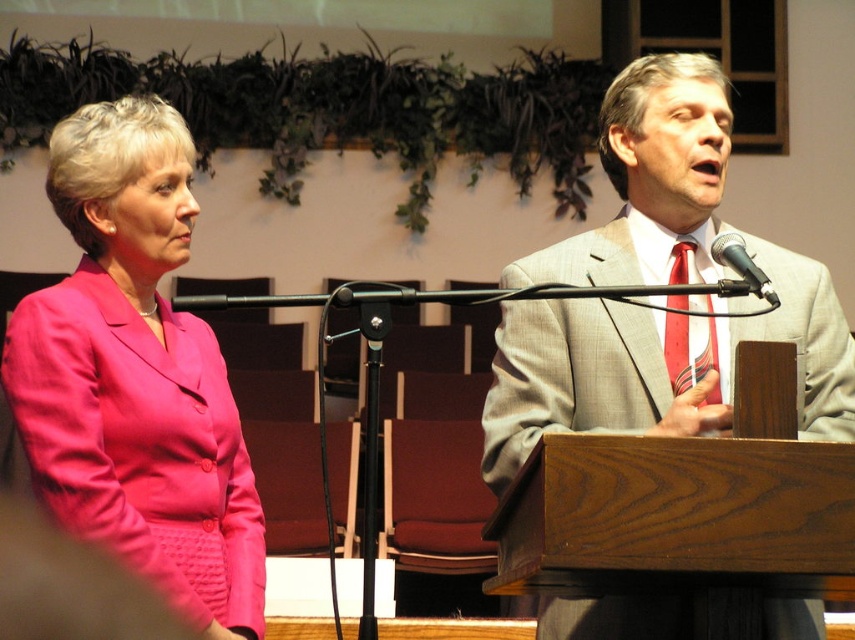
Does matte pink suit at left appear under striped silk tie at right?

Correct, matte pink suit at left is located below striped silk tie at right.

Between matte pink suit at left and striped silk tie at right, which one has more height?

matte pink suit at left is taller.

You are a GUI agent. You are given a task and a screenshot of the screen. Output one action in this format:
    pyautogui.click(x=<x>, y=<y>)
    Task: Click on the matte pink suit at left
    The width and height of the screenshot is (855, 640).
    Given the screenshot: What is the action you would take?
    pyautogui.click(x=136, y=376)

Is matte pink suit at left further to camera compared to black metallic microphone at upper right?

That is True.

Which of these two, matte pink suit at left or black metallic microphone at upper right, stands shorter?

black metallic microphone at upper right

This screenshot has height=640, width=855. What do you see at coordinates (136, 376) in the screenshot?
I see `matte pink suit at left` at bounding box center [136, 376].

Locate an element on the screen. The width and height of the screenshot is (855, 640). matte pink suit at left is located at coordinates (136, 376).

Does gray textured suit at center appear under black metallic microphone at upper right?

Yes, gray textured suit at center is below black metallic microphone at upper right.

This screenshot has height=640, width=855. What are the coordinates of `gray textured suit at center` in the screenshot? It's located at (655, 365).

Does point (617, 314) come behind point (764, 275)?

Yes, it is behind point (764, 275).

Find the location of a particular element. Image resolution: width=855 pixels, height=640 pixels. gray textured suit at center is located at coordinates (655, 365).